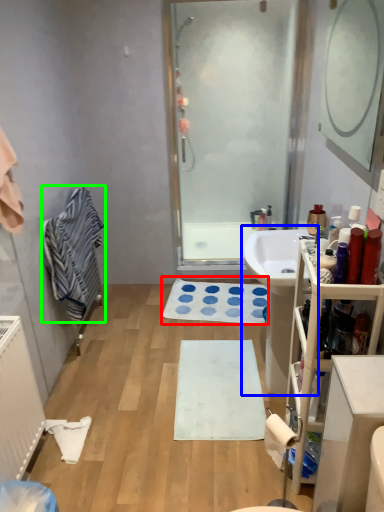
Question: Which is farther away from bath mat (highlighted by a red box)? sink (highlighted by a blue box) or bath towel (highlighted by a green box)?

Choices:
 (A) sink
 (B) bath towel

Answer: (B)